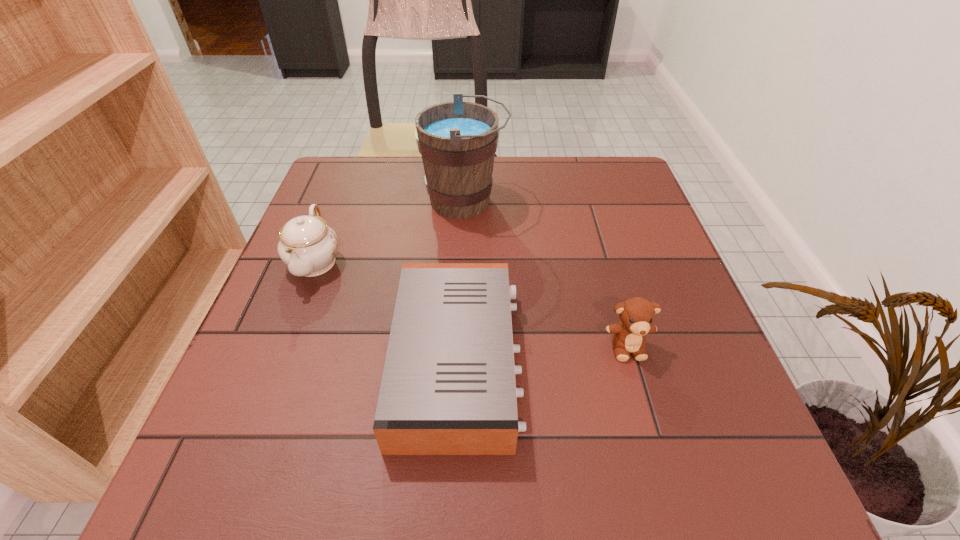
Where is `vacant space at the far right corner of the desktop`? vacant space at the far right corner of the desktop is located at coordinates (582, 199).

Identify the location of vacant area that lies between the wine bucket and the rightmost object. The width and height of the screenshot is (960, 540). (546, 274).

Locate an element on the screen. The image size is (960, 540). vacant region between the tallest object and the teddy bear is located at coordinates (x=546, y=274).

At what (x,y) coordinates should I click in order to perform the action: click on blank region between the leftmost object and the shortest object. Please return your answer as a coordinate pair (x, y). The width and height of the screenshot is (960, 540). Looking at the image, I should click on (387, 312).

Identify the location of vacant space that is in between the radio receiver and the rightmost object. Image resolution: width=960 pixels, height=540 pixels. (542, 354).

You are a GUI agent. You are given a task and a screenshot of the screen. Output one action in this format:
    pyautogui.click(x=<x>, y=<y>)
    Task: Click on the free space between the shortest object and the teddy bear
    Image resolution: width=960 pixels, height=540 pixels.
    Given the screenshot: What is the action you would take?
    pyautogui.click(x=542, y=354)

You are a GUI agent. You are given a task and a screenshot of the screen. Output one action in this format:
    pyautogui.click(x=<x>, y=<y>)
    Task: Click on the vacant region between the radio receiver and the third nearest object
    The width and height of the screenshot is (960, 540).
    Given the screenshot: What is the action you would take?
    pyautogui.click(x=387, y=312)

In order to click on vacant area that lies between the chinaware and the shortest object in this screenshot , I will do `click(387, 312)`.

This screenshot has width=960, height=540. I want to click on object that is the second nearest to the shortest object, so click(637, 314).

Where is `the closest object to the shortest object`? The image size is (960, 540). the closest object to the shortest object is located at coordinates (308, 246).